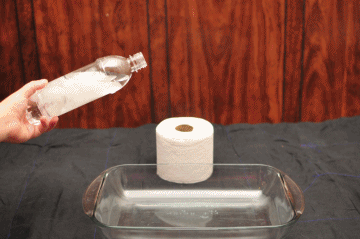
Where is `paper roll`? Image resolution: width=360 pixels, height=239 pixels. paper roll is located at coordinates (182, 116).